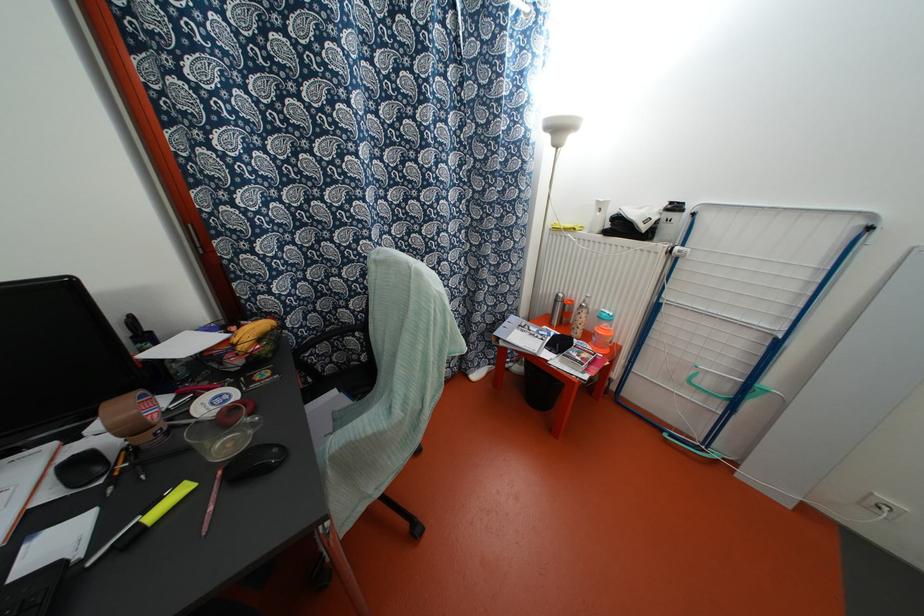
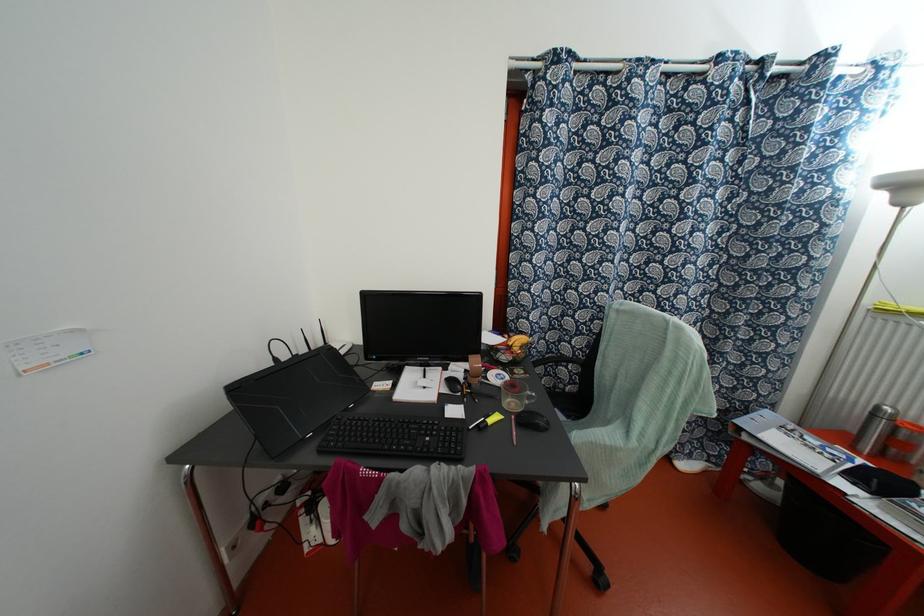
The point at (251, 424) is marked in the first image. Where is the corresponding point in the second image?

(529, 397)